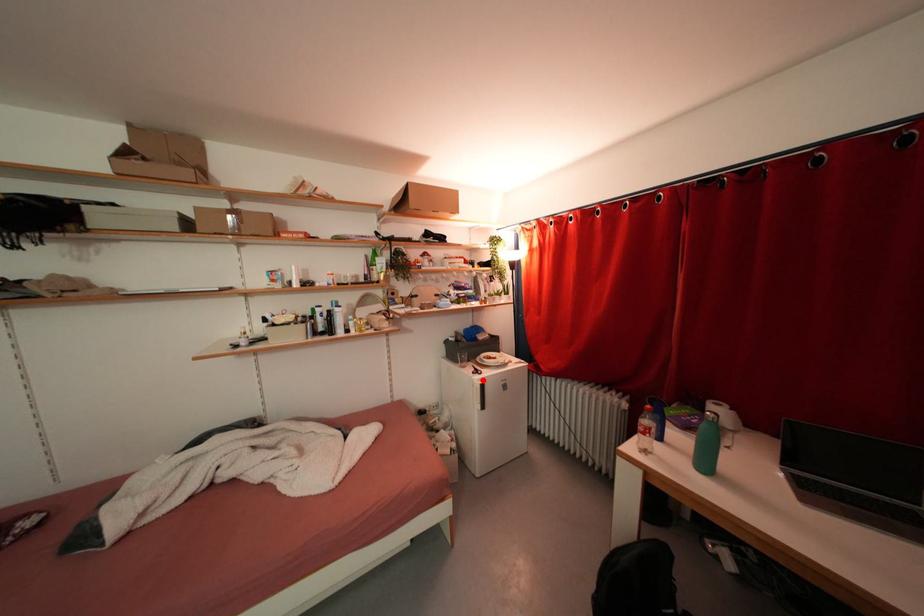
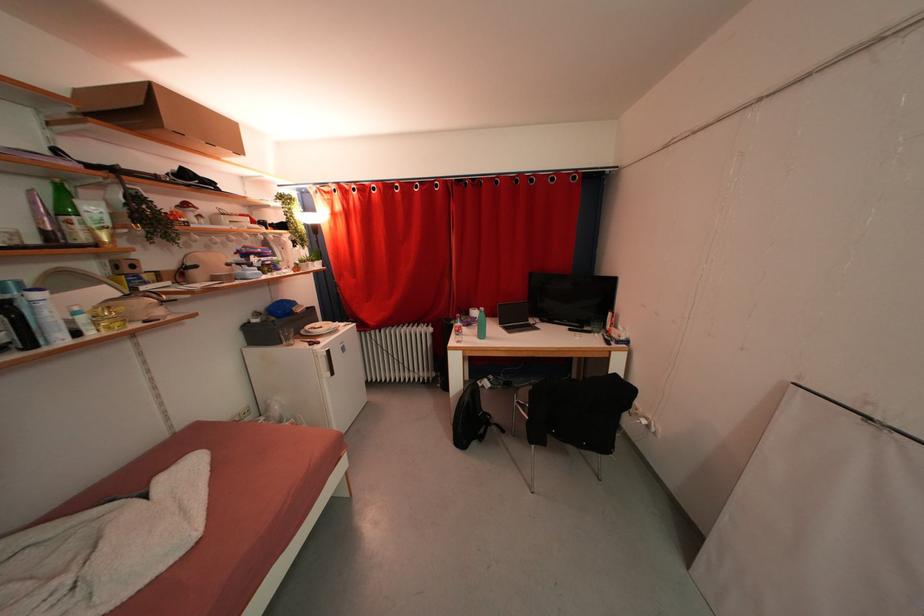
In the second image, find the point that corresponds to the highlighted location in the first image.

(322, 351)